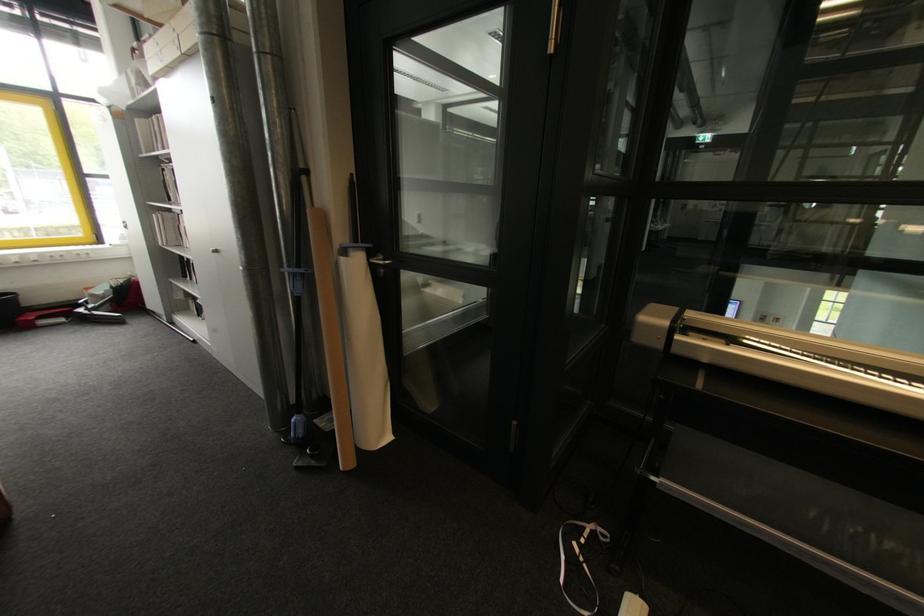
Which object does [8,309] point to?

This point indicates the black waste bin.